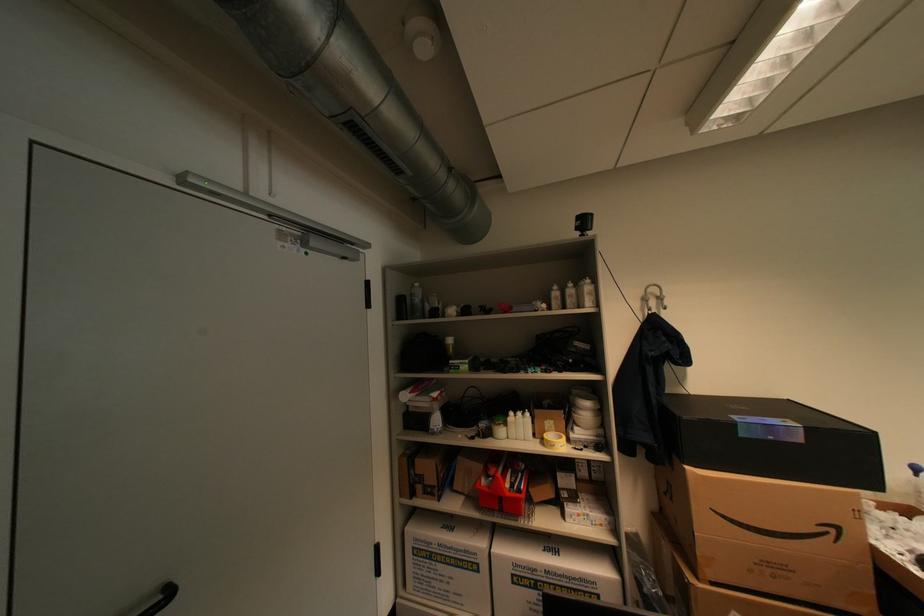
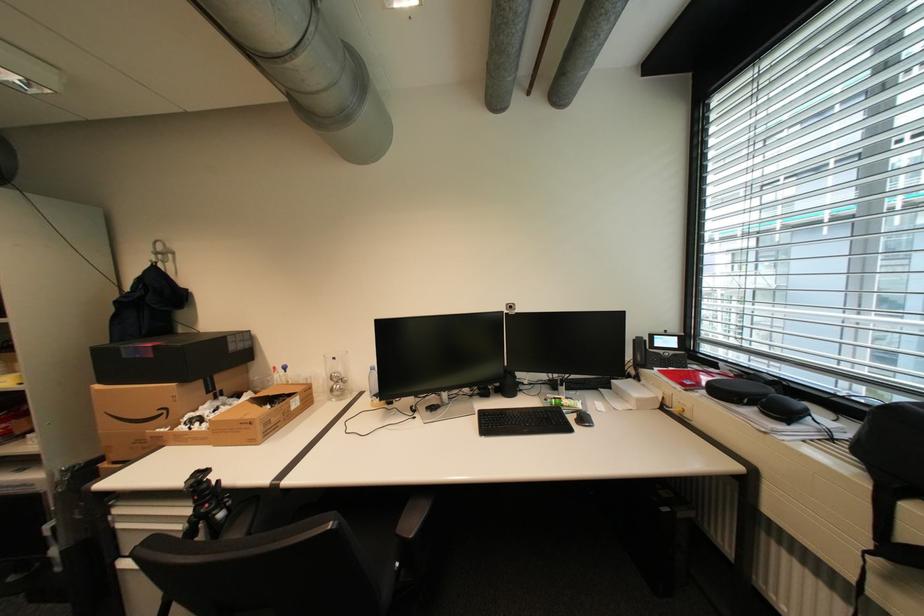
Question: Which direction would the cameraman need to move to produce the second image? Reply with the corresponding letter.

Choices:
 (A) Left
 (B) Right
 (C) Forward
 (D) Backward

Answer: (B)